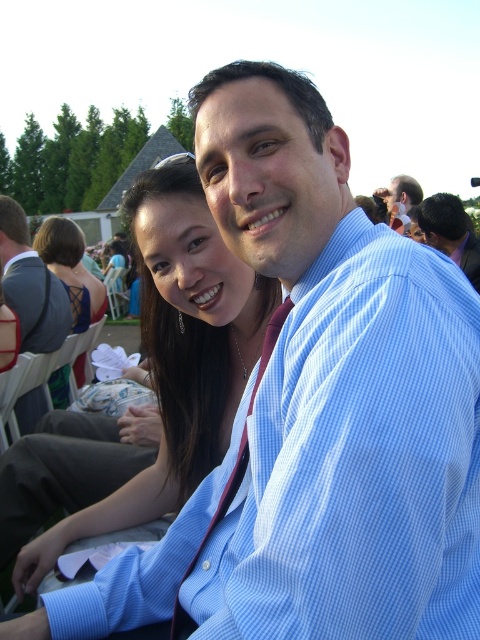
From the picture: You are at a formal outdoor event and notice a matte black dress at center. Can you determine if the dress is positioned closer to the bottom or the top of the image based on its coordinates?

The matte black dress at center is located at point 0.603 on the x and 0.319 on the y. Since the y coordinate is 0.319, which is closer to the bottom of the image, the dress is positioned closer to the bottom.